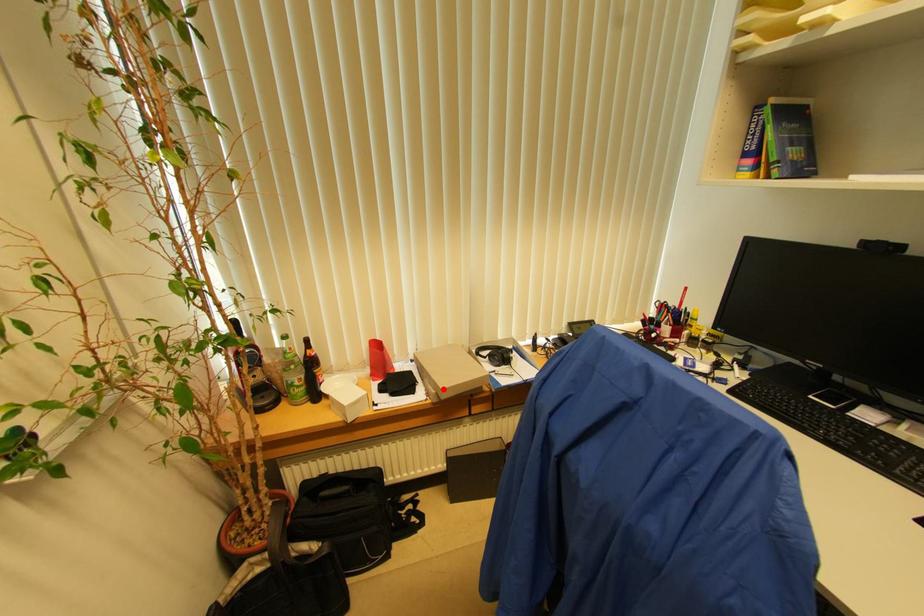
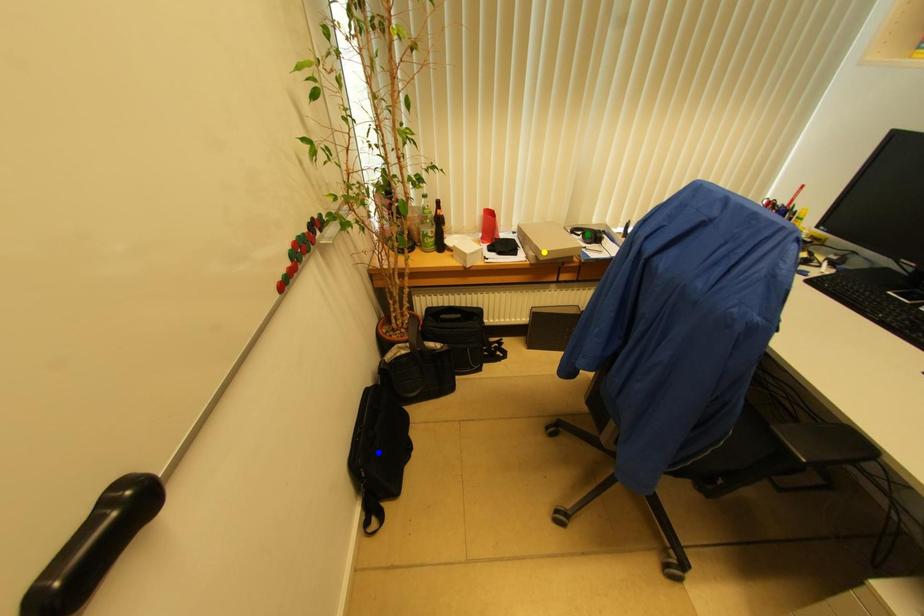
Question: I am providing you with two images of the same scene from different viewpoints. A red point is marked on the first image. You are given multiple points on the second image. Which spot in image 2 lines up with the point in image 1?

Choices:
 (A) blue point
 (B) green point
 (C) yellow point

Answer: (C)